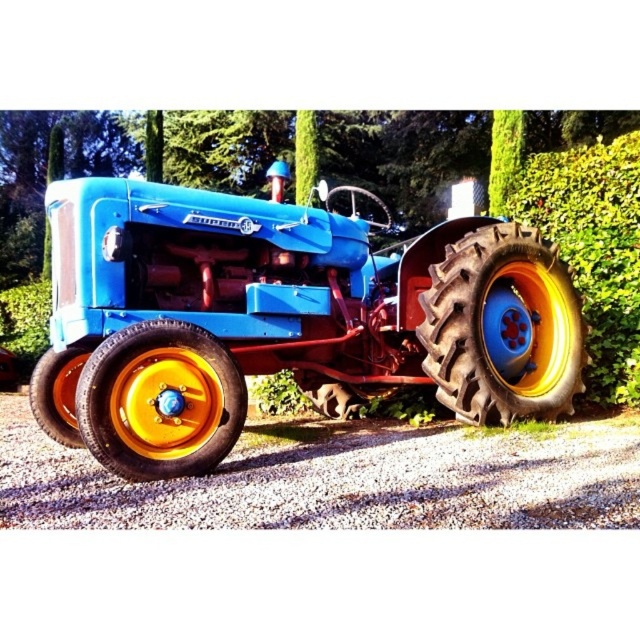
In the scene shown: Who is positioned more to the left, gravel at lower center or green leafy hedge at right?

gravel at lower center

Is gravel at lower center below green leafy hedge at right?

Indeed, gravel at lower center is positioned under green leafy hedge at right.

Locate an element on the screen. The image size is (640, 640). gravel at lower center is located at coordinates (340, 477).

Find the location of a particular element. gravel at lower center is located at coordinates (340, 477).

Identify the location of rubber/tread tire at center. (161, 401).

Is rubber/tread tire at center taller than green leafy hedge at right?

No, rubber/tread tire at center is not taller than green leafy hedge at right.

Which is in front, point (113, 432) or point (586, 195)?

Point (113, 432)

At what (x,y) coordinates should I click in order to perform the action: click on rubber/tread tire at center. Please return your answer as a coordinate pair (x, y). This screenshot has height=640, width=640. Looking at the image, I should click on (161, 401).

Does rubber/tread tire at center have a smaller size compared to rubber/textured tire at lower left?

Incorrect, rubber/tread tire at center is not smaller in size than rubber/textured tire at lower left.

Is rubber/tread tire at center below rubber/textured tire at lower left?

No.

Identify the location of rubber/tread tire at center. This screenshot has width=640, height=640. (161, 401).

Locate an element on the screen. This screenshot has width=640, height=640. rubber/tread tire at center is located at coordinates (161, 401).